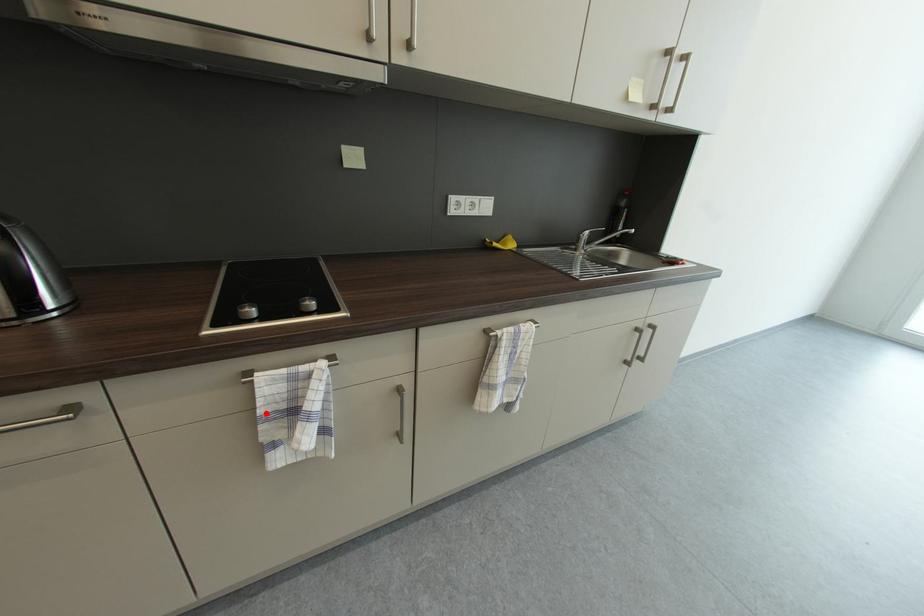
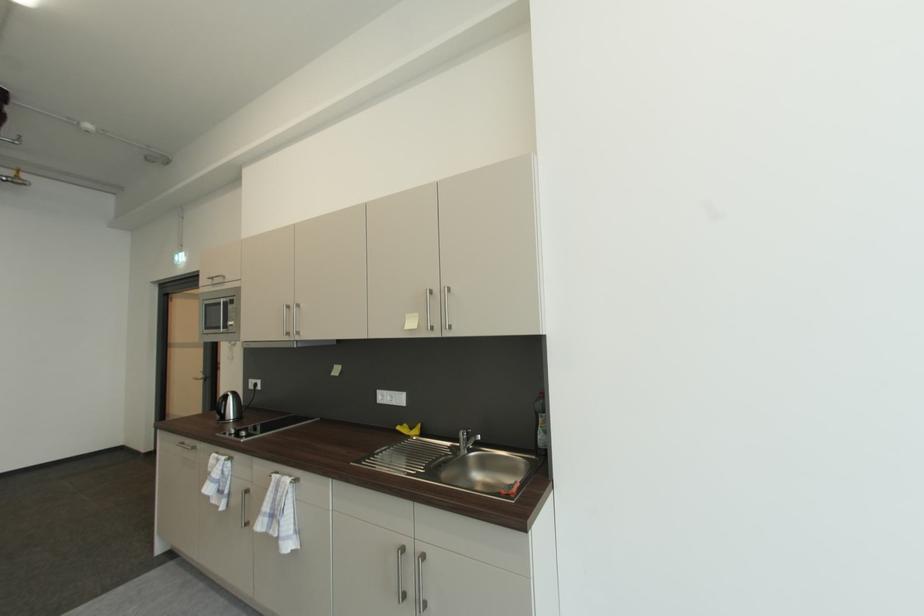
In the second image, find the point that corresponds to the highlighted location in the first image.

(215, 471)